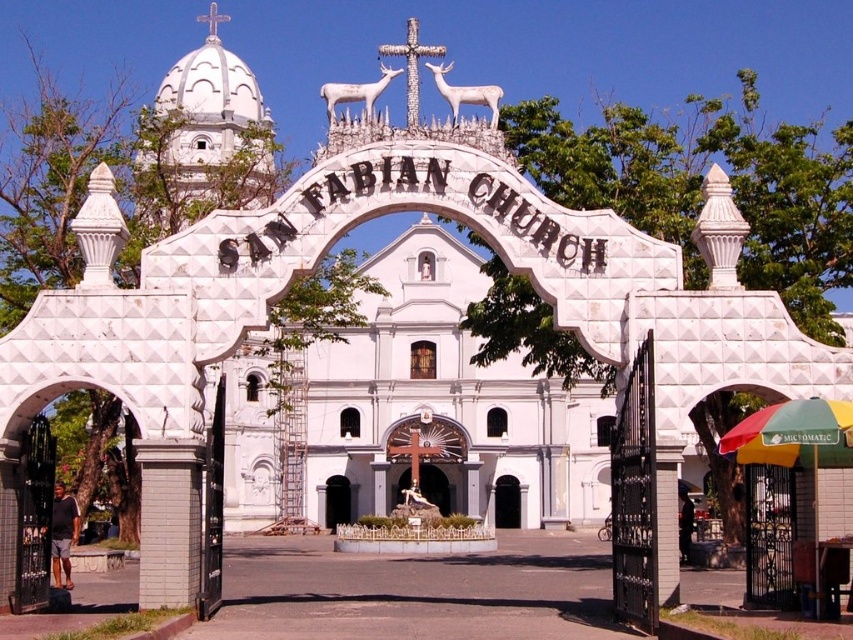
Is point (399, 74) positioned in front of point (514, 520)?

Yes, point (399, 74) is closer to viewer.

What are the coordinates of `white matte deer at center` in the screenshot? It's located at (357, 92).

Is white matte deer at upper center taller than black matte door at center?

Yes.

Does point (450, 102) lie behind point (517, 499)?

No, (450, 102) is closer to viewer.

I want to click on white matte deer at upper center, so tap(465, 93).

Does white matte deer at upper center have a larger size compared to white matte deer at center?

Actually, white matte deer at upper center might be smaller than white matte deer at center.

Is white matte deer at upper center below white matte deer at center?

Correct, white matte deer at upper center is located below white matte deer at center.

Where is `white matte deer at upper center`? This screenshot has height=640, width=853. white matte deer at upper center is located at coordinates (465, 93).